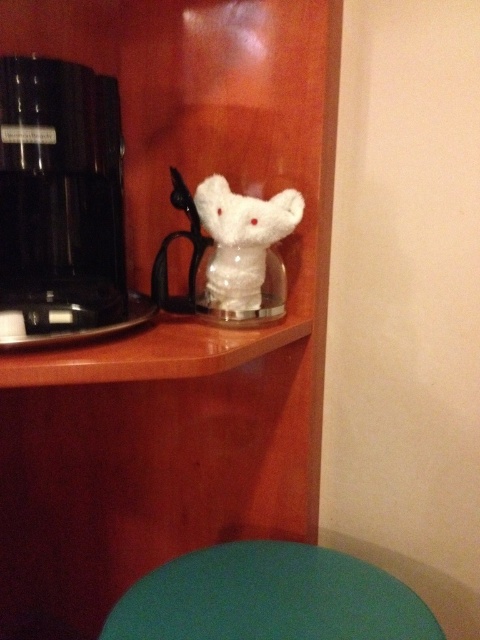
You are organizing items on the shelf and need to place a new item between the black plastic coffee machine at left and the teal matte table at lower center. Considering their heights, which item should be placed lower to ensure stability?

The teal matte table at lower center should be placed lower because the black plastic coffee machine at left is much taller than it, so placing the shorter teal matte table at lower center lower would help maintain stability.

You are standing in front of a wooden shelf and want to place a small object on the shelf. There are two points marked on the shelf at coordinates point (245, 609) and point (249, 276). Which point is closer to you so that you can easily reach it without stretching?

Point (245, 609) is closer to the viewer than point (249, 276), so you can easily reach it without stretching.

You are standing in front of the wooden shelf and want to place a small object on the shelf. You have two options to choose from. The first option is to place it at point (85, 269) and the second option is to place it at point (303, 628). Which point is closer to you?

Point (85, 269) is closer to you than point (303, 628) because it is further to the viewer.